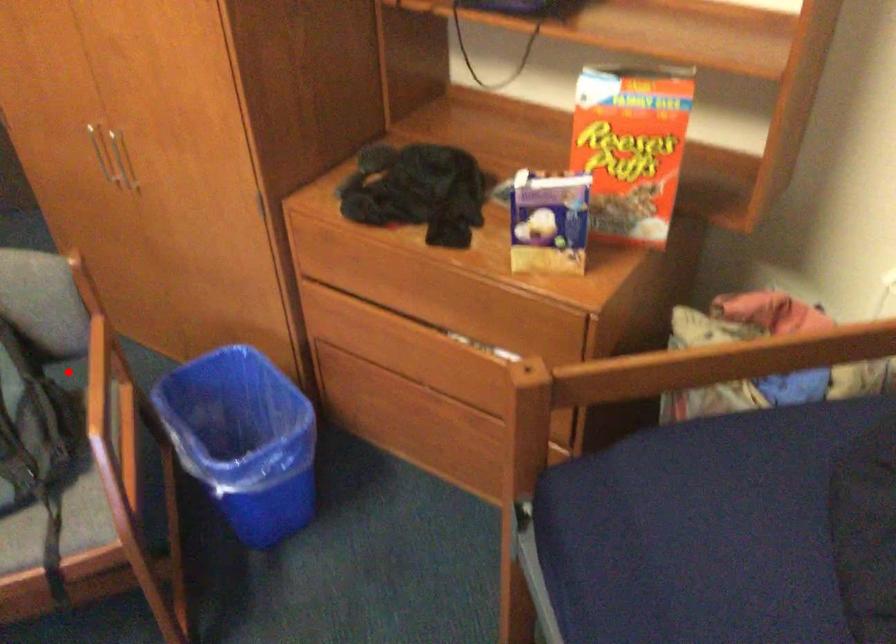
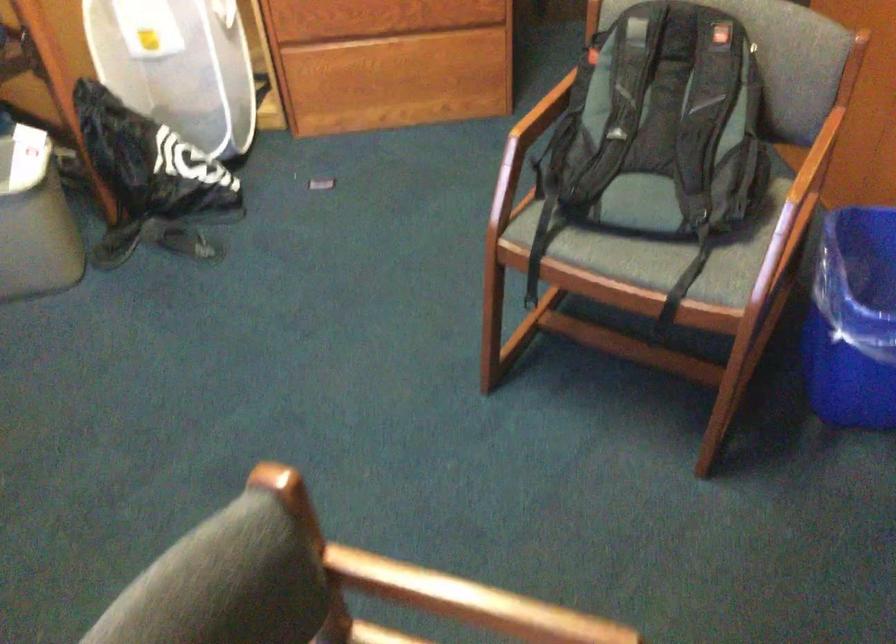
Question: I am providing you with two images of the same scene from different viewpoints. A red point is marked on the first image. Is the red point's position out of view in image 2?

Choices:
 (A) Yes
 (B) No

Answer: (A)